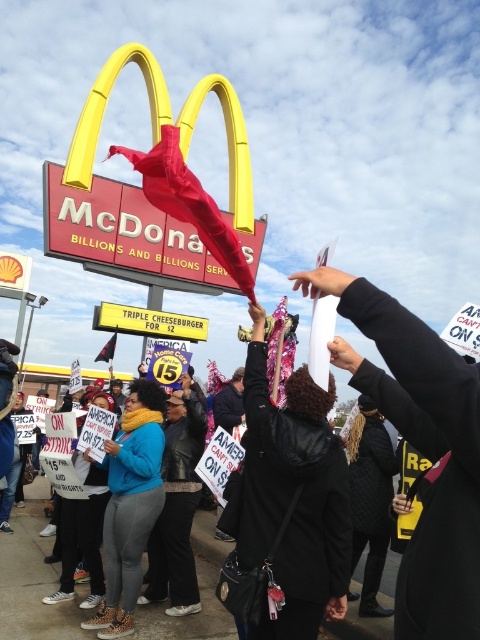
Is black fabric hat at upper center smaller than black leather jacket at center?

Yes.

Looking at this image, who is shorter, black fabric hat at upper center or black leather jacket at center?

black fabric hat at upper center is shorter.

This screenshot has width=480, height=640. What do you see at coordinates (421, 451) in the screenshot?
I see `black fabric hat at upper center` at bounding box center [421, 451].

The image size is (480, 640). Identify the location of black fabric hat at upper center. (421, 451).

Which is more to the left, black fabric hat at upper center or blue fleece jacket at center?

Positioned to the left is blue fleece jacket at center.

The image size is (480, 640). What do you see at coordinates (421, 451) in the screenshot? I see `black fabric hat at upper center` at bounding box center [421, 451].

Locate an element on the screen. black fabric hat at upper center is located at coordinates (421, 451).

Can you confirm if black leather jacket at center is bigger than blue fleece jacket at center?

Indeed, black leather jacket at center has a larger size compared to blue fleece jacket at center.

Is black leather jacket at center positioned before blue fleece jacket at center?

Yes.

In order to click on black leather jacket at center in this screenshot , I will do `click(290, 497)`.